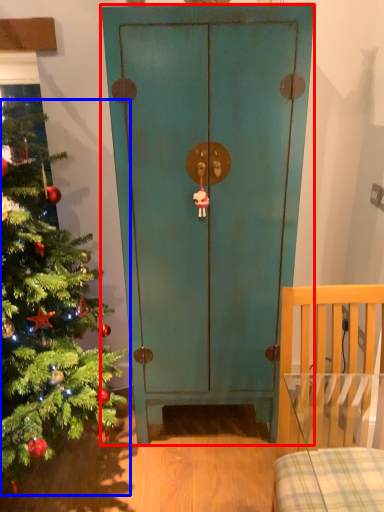
Question: Among these objects, which one is farthest to the camera, door (highlighted by a red box) or christmas tree (highlighted by a blue box)?

Choices:
 (A) door
 (B) christmas tree

Answer: (A)